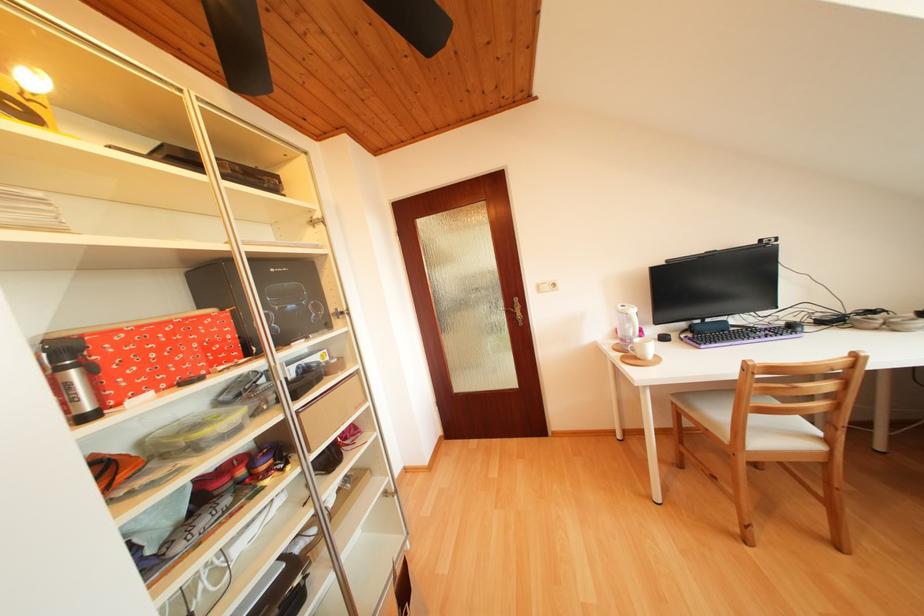
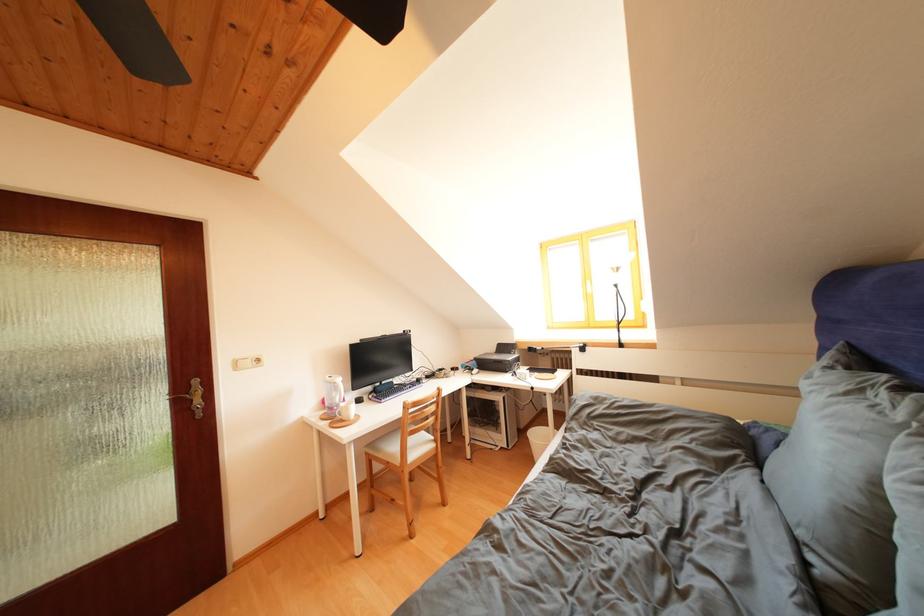
Find the pixel in the second image that matches [523,305] in the first image.

(201, 387)